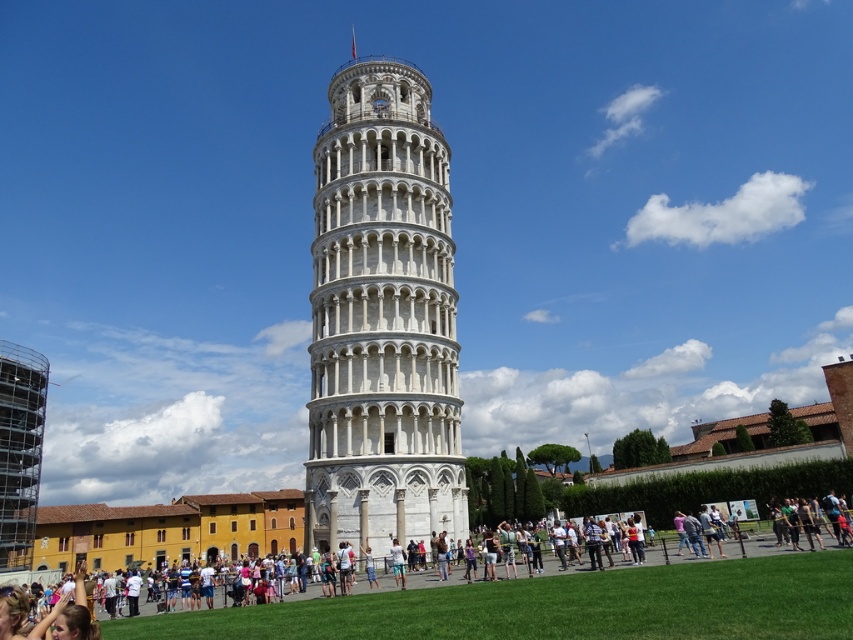
Between white marble tower at center and white stone tower at center, which one is positioned higher?

white marble tower at center is above.

Who is more forward, (383, 364) or (451, 593)?

Positioned in front is point (451, 593).

Where is `white marble tower at center`? The width and height of the screenshot is (853, 640). white marble tower at center is located at coordinates (381, 317).

Find the location of `white marble tower at center`. white marble tower at center is located at coordinates (381, 317).